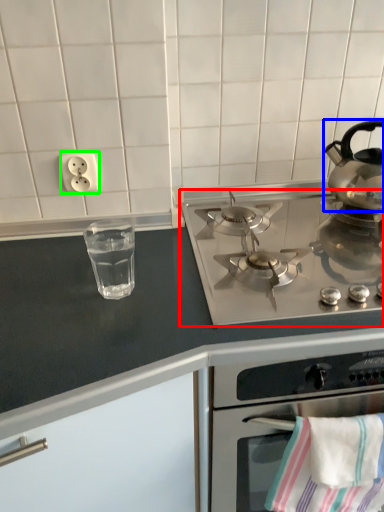
Question: Which object is positioned farthest from gas stove (highlighted by a red box)? Select from kettle (highlighted by a blue box) and electric outlet (highlighted by a green box).

Choices:
 (A) kettle
 (B) electric outlet

Answer: (B)